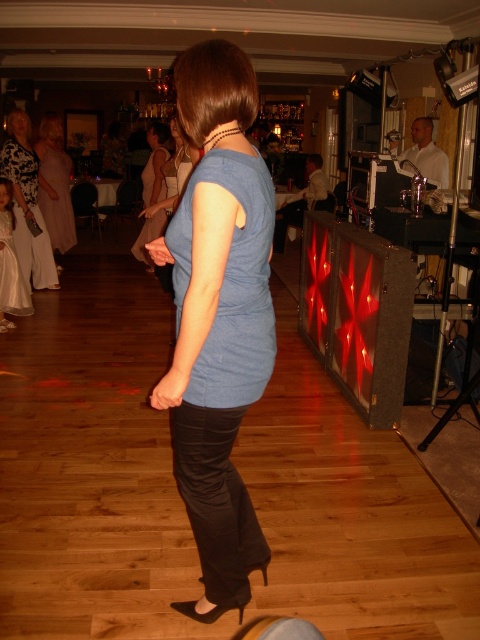
Can you confirm if matte blue shirt at center is positioned below white satin dress at left?

Yes, matte blue shirt at center is below white satin dress at left.

The image size is (480, 640). Describe the element at coordinates (217, 317) in the screenshot. I see `matte blue shirt at center` at that location.

Who is more forward, [178,320] or [35,177]?

Point [178,320] is in front.

Find the location of a particular element. matte blue shirt at center is located at coordinates (217, 317).

Which is above, matte blue shirt at center or light beige dress at center?

light beige dress at center

Does matte blue shirt at center have a lesser width compared to light beige dress at center?

Indeed, matte blue shirt at center has a lesser width compared to light beige dress at center.

Where is `matte blue shirt at center`? This screenshot has width=480, height=640. matte blue shirt at center is located at coordinates (217, 317).

Does white satin dress at left lie in front of white satin dress at lower left?

No, white satin dress at left is further to the viewer.

Can you confirm if white satin dress at left is shorter than white satin dress at lower left?

No.

Between point (38, 172) and point (25, 285), which one is positioned in front?

Point (25, 285) is in front.

Image resolution: width=480 pixels, height=640 pixels. I want to click on white satin dress at left, so click(x=27, y=204).